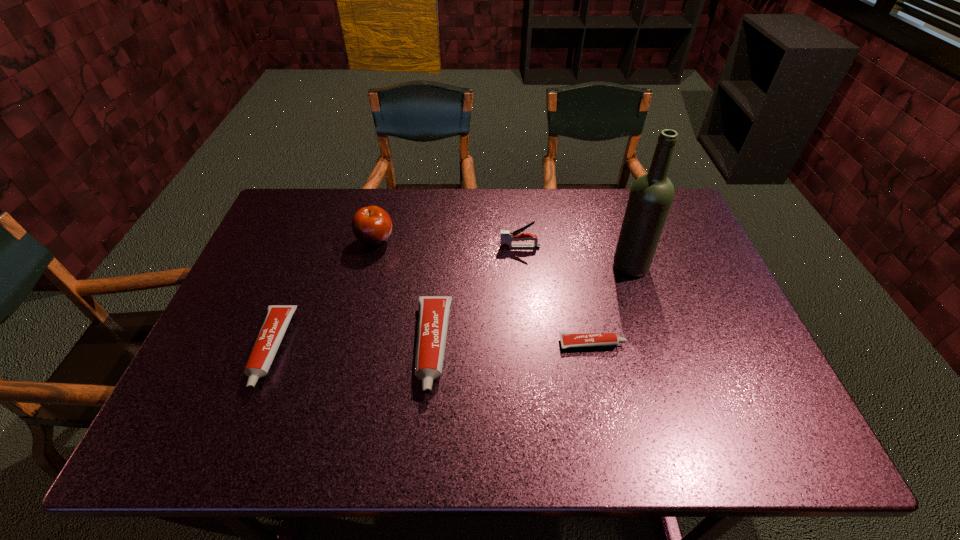
The height and width of the screenshot is (540, 960). Find the location of `the fifth shortest object`. the fifth shortest object is located at coordinates (371, 225).

Image resolution: width=960 pixels, height=540 pixels. I want to click on free space located 0.170m at the nozzle of the second object from right to left, so click(693, 344).

Find the location of a particular element. The height and width of the screenshot is (540, 960). vacant area located 0.070m on the front of the rightmost object is located at coordinates (640, 298).

Where is `free location located on the handle side of the fourth object from left to right`? free location located on the handle side of the fourth object from left to right is located at coordinates (424, 247).

Identify the location of free space located 0.290m on the handle side of the fourth object from left to right. (405, 247).

Find the location of `vacant space located 0.380m on the handle side of the fourth object from left to right`. vacant space located 0.380m on the handle side of the fourth object from left to right is located at coordinates (375, 247).

Locate an element on the screen. The image size is (960, 540). free location located 0.100m on the front of the fifth shortest object is located at coordinates (367, 278).

Identify the location of object situated at the far edge. (371, 225).

Identify the location of object at the left edge. Image resolution: width=960 pixels, height=540 pixels. (277, 318).

Identify the location of object that is at the near left corner. This screenshot has height=540, width=960. (277, 318).